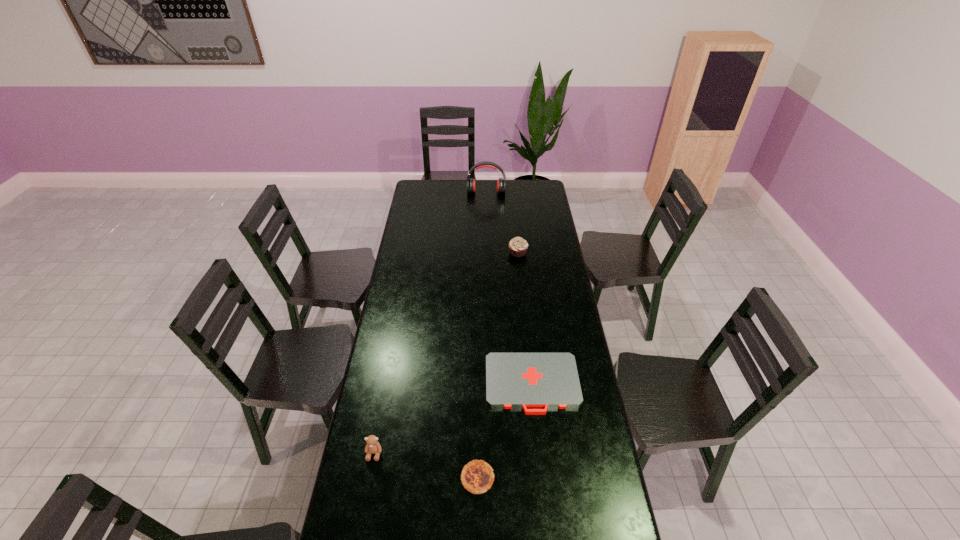
At what (x,y) coordinates should I click in order to perform the action: click on earphone. Please return your answer as a coordinate pair (x, y). Looking at the image, I should click on click(x=501, y=183).

In order to click on the farthest object in this screenshot , I will do `click(501, 183)`.

Locate an element on the screen. The image size is (960, 540). muffin is located at coordinates (518, 246).

Locate an element on the screen. This screenshot has width=960, height=540. the second nearest object is located at coordinates (372, 447).

At what (x,y) coordinates should I click in order to perform the action: click on teddy bear. Please return your answer as a coordinate pair (x, y). This screenshot has width=960, height=540. Looking at the image, I should click on (372, 447).

Identify the location of the fourth tallest object. The image size is (960, 540). (477, 476).

Identify the location of quiche. (477, 476).

The height and width of the screenshot is (540, 960). What are the coordinates of `the shortest object` in the screenshot? It's located at (523, 380).

Where is `the first-aid kit`? The height and width of the screenshot is (540, 960). the first-aid kit is located at coordinates (523, 380).

Image resolution: width=960 pixels, height=540 pixels. I want to click on vacant space situated on the ear cups of the farthest object, so click(487, 205).